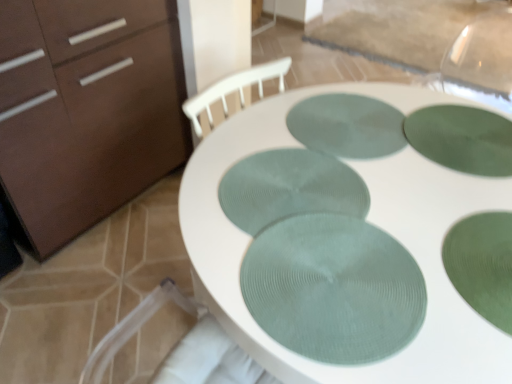
Question: Is white textured placemats at center to the left or to the right of matte brown cabinet at left in the image?

Choices:
 (A) right
 (B) left

Answer: (A)

Question: Does point (409, 372) appear closer or farther from the camera than point (111, 11)?

Choices:
 (A) farther
 (B) closer

Answer: (B)

Question: Which is farther from the green textured glass plate at center, placed as the fifth glass plate when sorted from back to front?

Choices:
 (A) green textured glass plate at upper right, placed as the 2th glass plate when sorted from back to front
 (B) white textured placemats at center
 (C) matte brown cabinet at left
 (D) green textured glass at center, positioned as the fourth glass plate in back-to-front order
 (E) green textured placemat at center, which is the fifth glass plate in front-to-back order

Answer: (C)

Question: Estimate the real-world distances between objects in this image. Which object is closer to the green textured glass plate at center, the 3th glass plate viewed from the back?

Choices:
 (A) white textured placemats at center
 (B) green textured glass plate at center, placed as the fifth glass plate when sorted from back to front
 (C) matte brown cabinet at left
 (D) green textured glass at center, positioned as the fourth glass plate in back-to-front order
 (E) green textured placemat at center, which is the fifth glass plate in front-to-back order

Answer: (A)